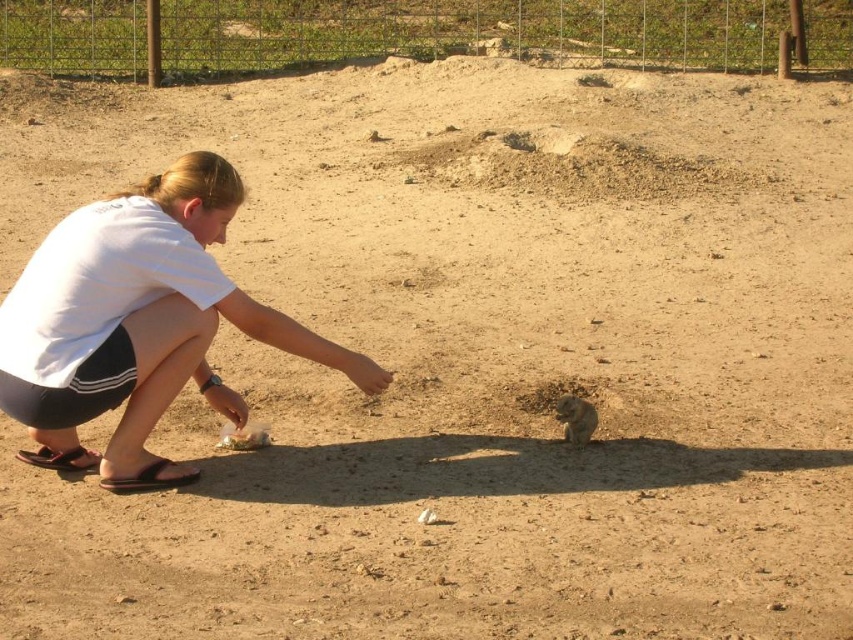
Where is the white matte shirt at center located in the image?

The white matte shirt at center is located at point 0.506 on the horizontal axis and 0.162 on the vertical axis.

You are a photographer trying to capture a clear photo of the young girl and the small animal. You notice two points marked in the image. The first point is at coordinates point (523, 401) and the second point is at coordinates point (567, 397). Which point should you focus on to ensure the subject is sharp?

You should focus on point (523, 401) because it is closer to the camera than point (567, 397). Since it is closer, focusing on this point will ensure the subject is sharp.

You are standing at the point labeled point (126, 248) and want to move towards the point labeled point (546, 397). Will you be moving away from or towards the young girl?

The point labeled point (126, 248) is in front of point labeled point (546, 397). So moving from point (126, 248) towards point (546, 397) means you are moving away from the young girl.